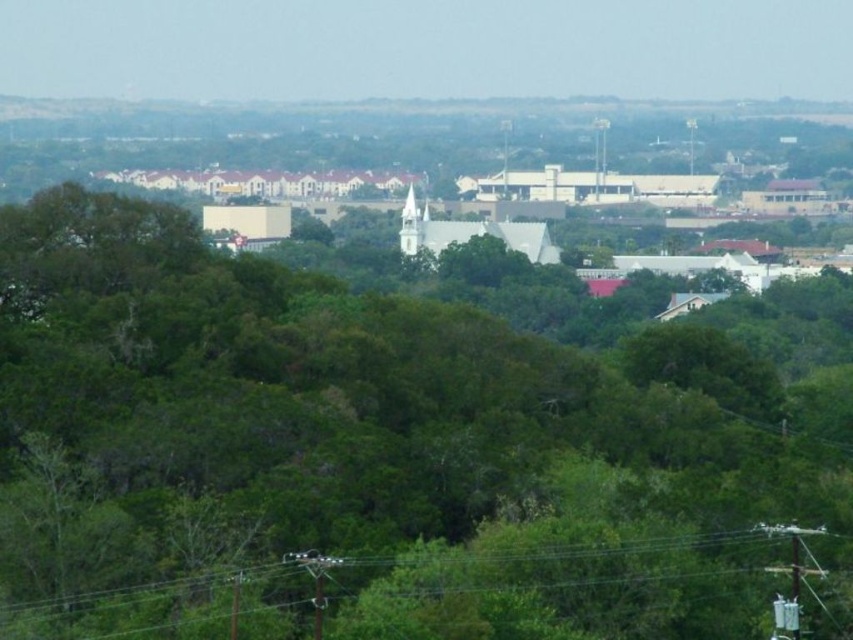
Question: Can you confirm if green leafy tree at center is wider than green wire at lower center?

Choices:
 (A) yes
 (B) no

Answer: (A)

Question: Which point is closer to the camera taking this photo?

Choices:
 (A) (425, 577)
 (B) (799, 513)

Answer: (A)

Question: In this image, where is green leafy tree at center located relative to green wire at lower center?

Choices:
 (A) below
 (B) above

Answer: (B)

Question: Does green leafy tree at center appear on the left side of green wire at lower center?

Choices:
 (A) no
 (B) yes

Answer: (A)